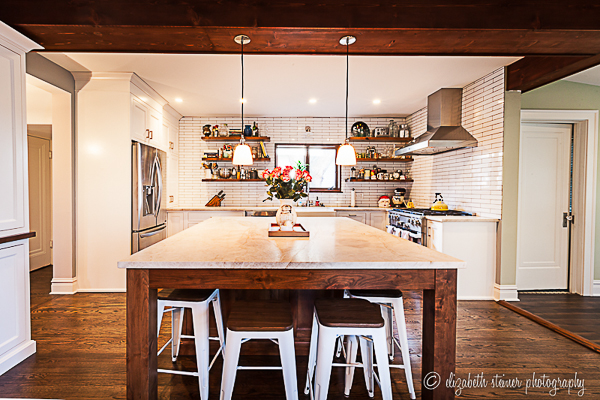
At what (x,y) coordinates should I click in order to perform the action: click on light. Please return your answer as a coordinate pair (x, y). The height and width of the screenshot is (400, 600). Looking at the image, I should click on (244, 158), (345, 154), (177, 100), (243, 100), (313, 102), (374, 100).